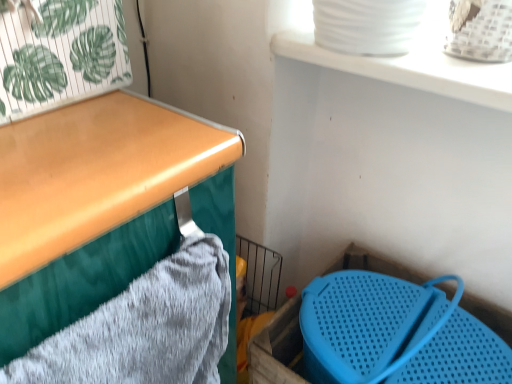
Question: Is point (494, 317) positioned closer to the camera than point (72, 87)?

Choices:
 (A) closer
 (B) farther

Answer: (B)

Question: From their relative heights in the image, would you say blue plastic storage box at lower right is taller or shorter than green leafy paper at upper left?

Choices:
 (A) short
 (B) tall

Answer: (B)

Question: Estimate the real-world distances between objects in this image. Which object is closer to the gray textured bath towel at left?

Choices:
 (A) blue plastic storage box at lower right
 (B) green leafy paper at upper left

Answer: (B)

Question: Estimate the real-world distances between objects in this image. Which object is closer to the blue plastic storage box at lower right?

Choices:
 (A) green leafy paper at upper left
 (B) gray textured bath towel at left

Answer: (B)